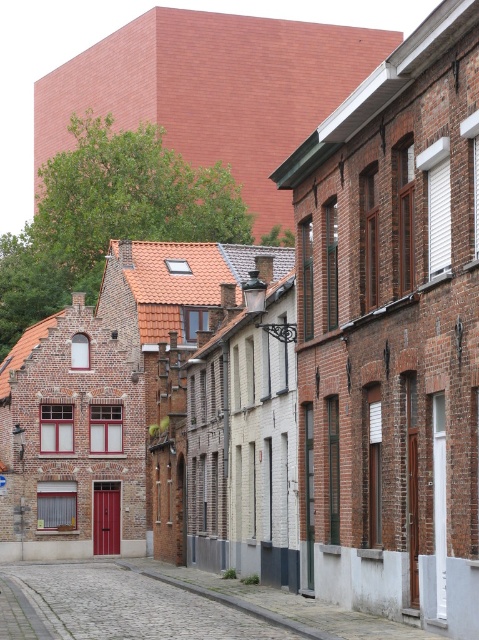
Question: Which of the following is the farthest from the observer?

Choices:
 (A) (353, 275)
 (B) (22, 566)

Answer: (B)

Question: Which of the following is the closest to the observer?

Choices:
 (A) (15, 572)
 (B) (455, 458)

Answer: (B)

Question: Does brick building at center appear on the left side of cobblestone street at center?

Choices:
 (A) no
 (B) yes

Answer: (A)

Question: Is brick building at center smaller than cobblestone street at center?

Choices:
 (A) no
 (B) yes

Answer: (B)

Question: Does brick building at center have a larger size compared to cobblestone street at center?

Choices:
 (A) yes
 (B) no

Answer: (B)